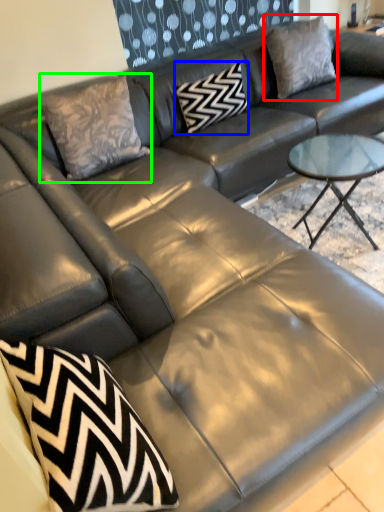
Question: Which is nearer to the pillow (highlighted by a red box)? pillow (highlighted by a blue box) or throw pillow (highlighted by a green box).

Choices:
 (A) pillow
 (B) throw pillow

Answer: (A)